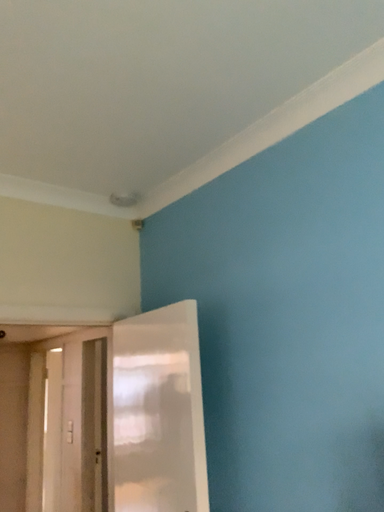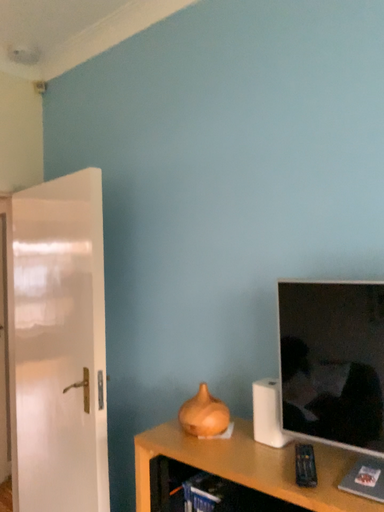
Question: How did the camera likely rotate when shooting the video?

Choices:
 (A) rotated upward
 (B) rotated downward

Answer: (B)